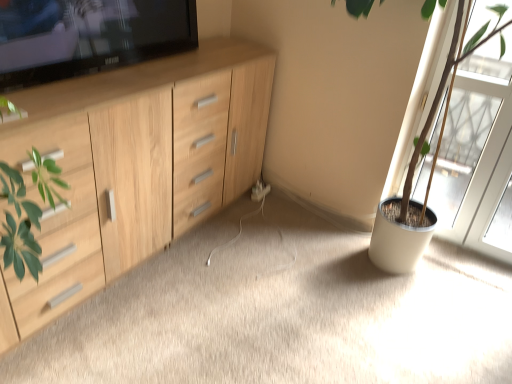
Locate an element on the screen. free space in front of transparent glass screen door at right is located at coordinates (467, 283).